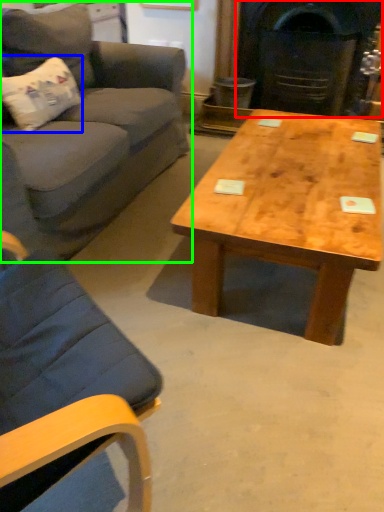
Question: Which object is the closest to the fireplace (highlighted by a red box)? Choose among these: pillow (highlighted by a blue box) or studio couch (highlighted by a green box).

Choices:
 (A) pillow
 (B) studio couch

Answer: (B)